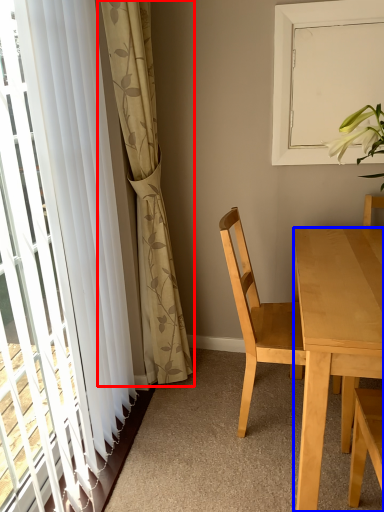
Question: Which of the following is the farthest to the observer, curtain (highlighted by a red box) or desk (highlighted by a blue box)?

Choices:
 (A) curtain
 (B) desk

Answer: (A)